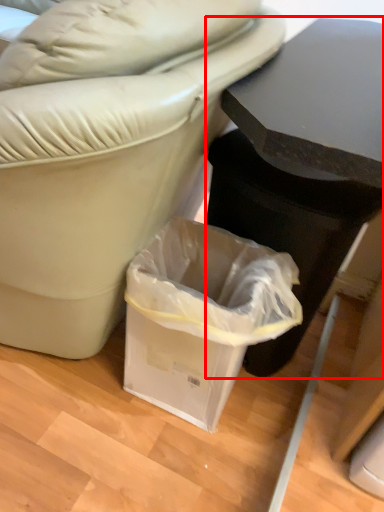
Question: Where is table (annotated by the red box) located in relation to waste container in the image?

Choices:
 (A) right
 (B) left

Answer: (A)